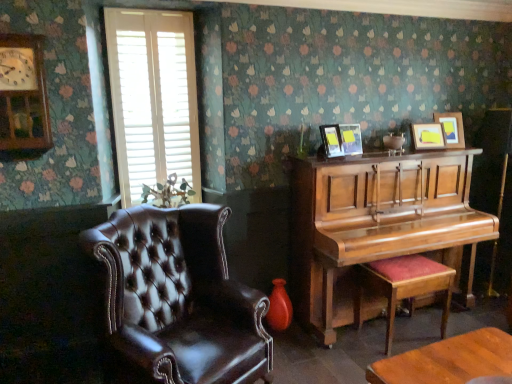
Question: Does point (332, 142) appear closer or farther from the camera than point (465, 299)?

Choices:
 (A) closer
 (B) farther

Answer: (A)

Question: Looking at their shapes, would you say matte black picture frame at upper center, placed as the fourth picture frame when sorted from right to left, is wider or thinner than shiny brown piano at right?

Choices:
 (A) wide
 (B) thin

Answer: (B)

Question: Which of these objects is positioned closest to the brown leather armchair at left?

Choices:
 (A) wooden clock at upper left
 (B) matte wooden picture frame at upper right, placed as the third picture frame when sorted from left to right
 (C) matte black picture frame at upper center, placed as the fourth picture frame when sorted from right to left
 (D) shiny brown piano at right
 (E) wooden polished stool at right

Answer: (D)

Question: Which of these objects is positioned farthest from the matte black picture frame at upper center, placed as the fourth picture frame when sorted from right to left?

Choices:
 (A) wooden polished stool at right
 (B) white wood blinds at upper left
 (C) wooden picture frame at upper right, marked as the 1th picture frame in a right-to-left arrangement
 (D) matte wooden picture frame at upper right, placed as the third picture frame when sorted from left to right
 (E) matte gold picture frame at upper right, which appears as the 3th picture frame when viewed from the right

Answer: (B)